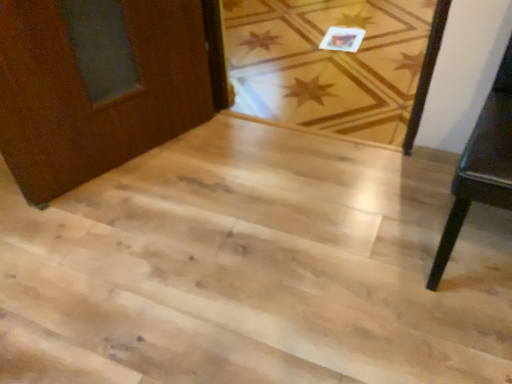
Question: Can you confirm if dark wood table at right is taller than light wood floor at center?

Choices:
 (A) no
 (B) yes

Answer: (B)

Question: Is dark wood table at right oriented away from light wood floor at center?

Choices:
 (A) no
 (B) yes

Answer: (A)

Question: Could light wood floor at center be considered to be inside dark wood table at right?

Choices:
 (A) no
 (B) yes

Answer: (A)

Question: Would you say dark wood table at right is a long distance from light wood floor at center?

Choices:
 (A) yes
 (B) no

Answer: (A)

Question: Is dark wood table at right bigger than light wood floor at center?

Choices:
 (A) yes
 (B) no

Answer: (B)

Question: Considering the positions of light wood stairs at center and light wood floor at center in the image, is light wood stairs at center wider or thinner than light wood floor at center?

Choices:
 (A) thin
 (B) wide

Answer: (A)

Question: Is light wood stairs at center inside or outside of light wood floor at center?

Choices:
 (A) outside
 (B) inside

Answer: (A)

Question: Is point (104, 327) positioned closer to the camera than point (283, 18)?

Choices:
 (A) closer
 (B) farther

Answer: (A)

Question: In terms of height, does light wood stairs at center look taller or shorter compared to light wood floor at center?

Choices:
 (A) tall
 (B) short

Answer: (B)

Question: Considering the positions of point (428, 279) and point (110, 319), is point (428, 279) closer or farther from the camera than point (110, 319)?

Choices:
 (A) farther
 (B) closer

Answer: (A)

Question: Considering their positions, is dark wood table at right located in front of or behind light wood stairs at center?

Choices:
 (A) behind
 (B) front

Answer: (B)

Question: Is dark wood table at right wider or thinner than light wood stairs at center?

Choices:
 (A) wide
 (B) thin

Answer: (B)

Question: Choose the correct answer: Is dark wood table at right inside light wood stairs at center or outside it?

Choices:
 (A) inside
 (B) outside

Answer: (B)

Question: In the image, is dark wood table at right positioned in front of or behind light wood floor at center?

Choices:
 (A) behind
 (B) front

Answer: (B)

Question: In terms of width, does dark wood table at right look wider or thinner when compared to light wood floor at center?

Choices:
 (A) wide
 (B) thin

Answer: (B)